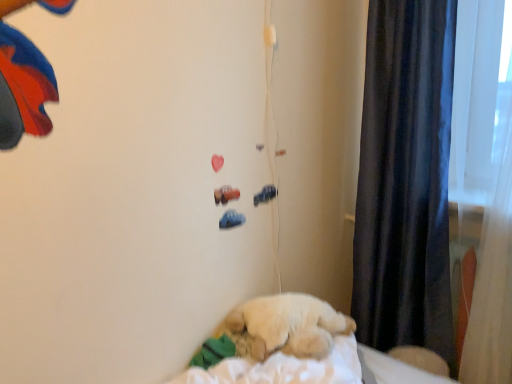
Question: Is white soft sheet at lower right turned away from dark blue velvet curtain at right?

Choices:
 (A) yes
 (B) no

Answer: (B)

Question: Is white soft sheet at lower right smaller than dark blue velvet curtain at right?

Choices:
 (A) no
 (B) yes

Answer: (A)

Question: Is white soft sheet at lower right thinner than dark blue velvet curtain at right?

Choices:
 (A) no
 (B) yes

Answer: (A)

Question: Would you say dark blue velvet curtain at right is part of white soft sheet at lower right's contents?

Choices:
 (A) no
 (B) yes

Answer: (A)

Question: Considering the relative positions of white soft sheet at lower right and dark blue velvet curtain at right in the image provided, is white soft sheet at lower right to the right of dark blue velvet curtain at right from the viewer's perspective?

Choices:
 (A) yes
 (B) no

Answer: (A)

Question: From the image's perspective, is white soft sheet at lower right positioned above or below fluffy beige dog at center?

Choices:
 (A) below
 (B) above

Answer: (A)

Question: From a real-world perspective, is white soft sheet at lower right physically located above or below fluffy beige dog at center?

Choices:
 (A) below
 (B) above

Answer: (A)

Question: Considering the positions of white soft sheet at lower right and fluffy beige dog at center in the image, is white soft sheet at lower right taller or shorter than fluffy beige dog at center?

Choices:
 (A) tall
 (B) short

Answer: (B)

Question: Based on their sizes in the image, would you say white soft sheet at lower right is bigger or smaller than fluffy beige dog at center?

Choices:
 (A) big
 (B) small

Answer: (B)

Question: Considering the positions of point (422, 6) and point (243, 352), is point (422, 6) closer or farther from the camera than point (243, 352)?

Choices:
 (A) farther
 (B) closer

Answer: (A)

Question: From a real-world perspective, is dark blue velvet curtain at right physically located above or below fluffy beige dog at center?

Choices:
 (A) below
 (B) above

Answer: (B)

Question: Is dark blue velvet curtain at right inside the boundaries of fluffy beige dog at center, or outside?

Choices:
 (A) inside
 (B) outside

Answer: (B)

Question: From their relative heights in the image, would you say dark blue velvet curtain at right is taller or shorter than fluffy beige dog at center?

Choices:
 (A) short
 (B) tall

Answer: (B)

Question: Is white soft sheet at lower right wider or thinner than dark blue velvet curtain at right?

Choices:
 (A) thin
 (B) wide

Answer: (B)

Question: Considering the positions of white soft sheet at lower right and dark blue velvet curtain at right in the image, is white soft sheet at lower right bigger or smaller than dark blue velvet curtain at right?

Choices:
 (A) big
 (B) small

Answer: (A)